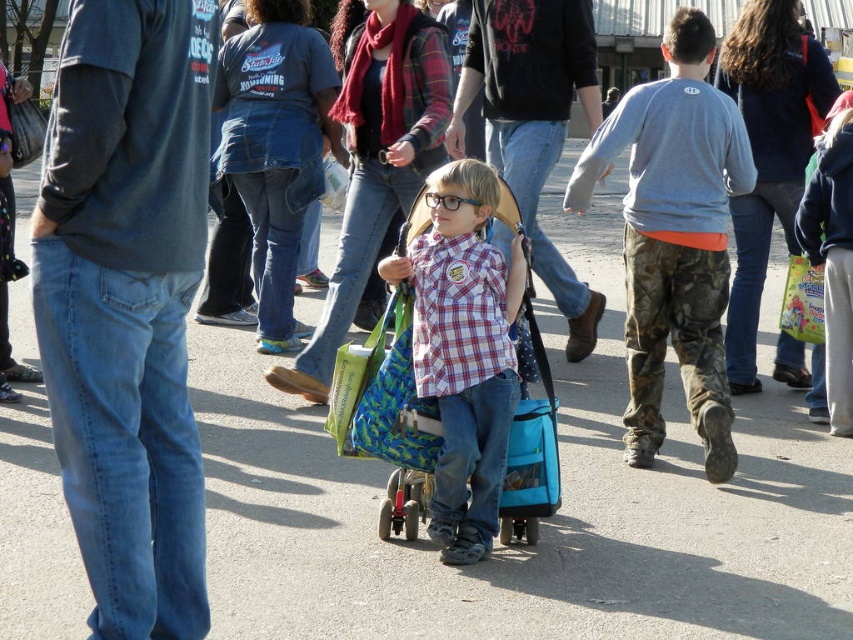
Which is above, camouflage pants at right or plaid cotton shirt at center?

camouflage pants at right

Is camouflage pants at right bigger than plaid cotton shirt at center?

Indeed, camouflage pants at right has a larger size compared to plaid cotton shirt at center.

This screenshot has height=640, width=853. Identify the location of camouflage pants at right. (674, 237).

Where is `camouflage pants at right`? This screenshot has width=853, height=640. camouflage pants at right is located at coordinates (674, 237).